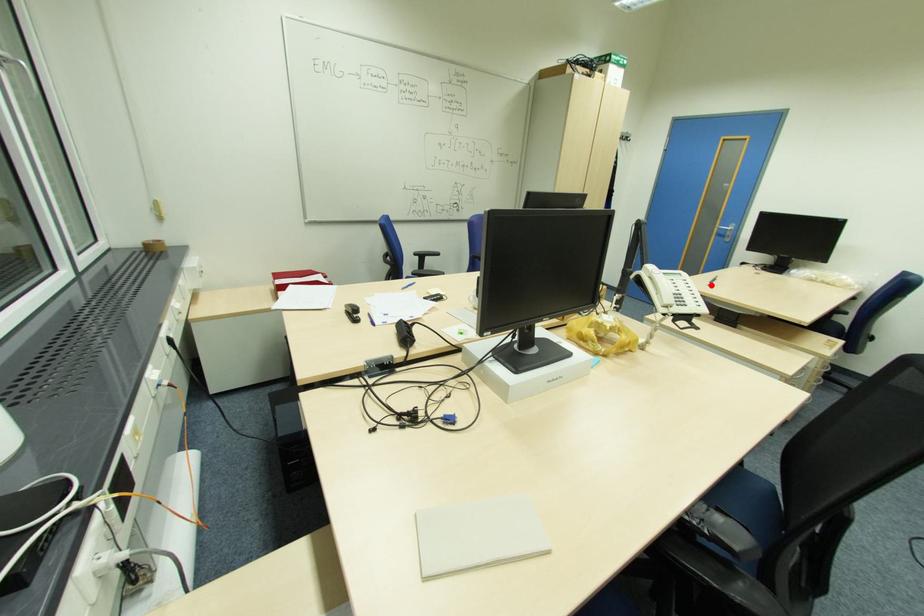
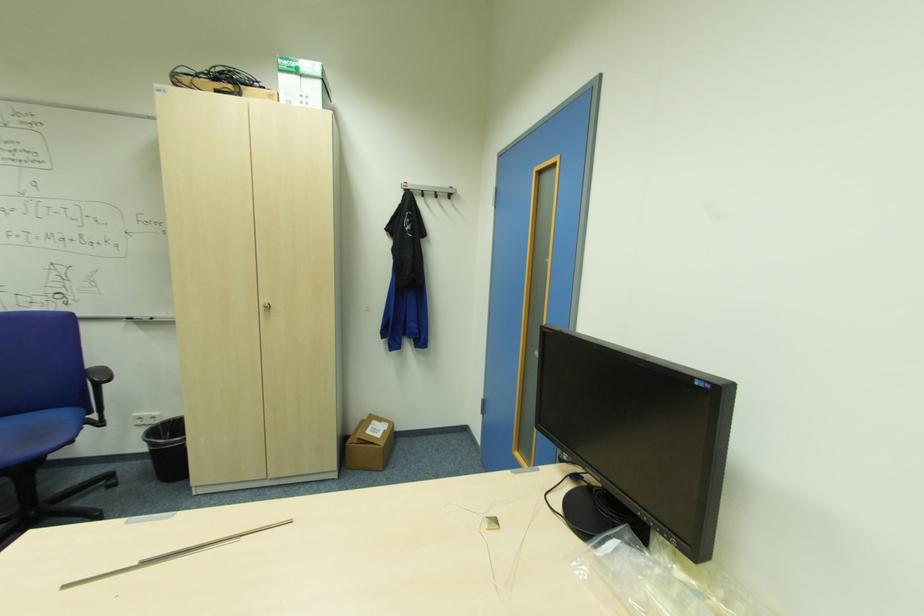
Question: A red point is marked in image1. In image2, is the corresponding 3D point closer to the camera or farther? Reply with the corresponding letter.

Choices:
 (A) The corresponding 3D point is closer.
 (B) The corresponding 3D point is farther.

Answer: (A)